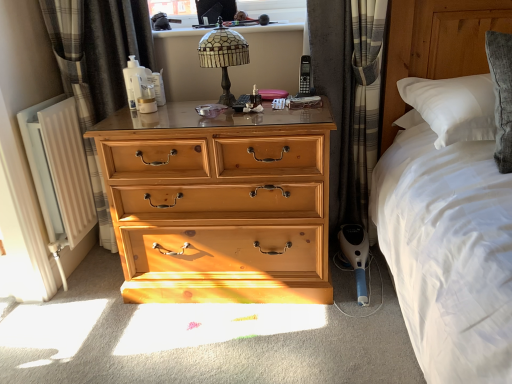
This screenshot has width=512, height=384. What are the coordinates of `free spot to the left of wooden chest of drawers at center` in the screenshot? It's located at (77, 316).